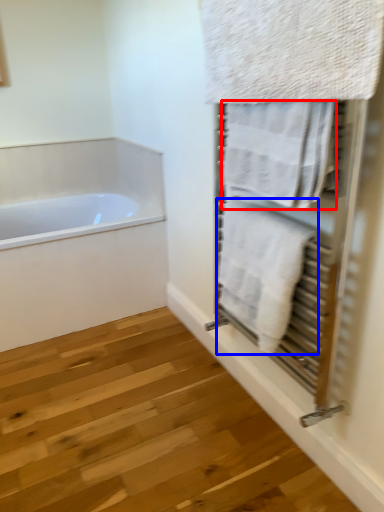
Question: Which of the following is the farthest to the observer, towel (highlighted by a red box) or towel (highlighted by a blue box)?

Choices:
 (A) towel
 (B) towel

Answer: (B)